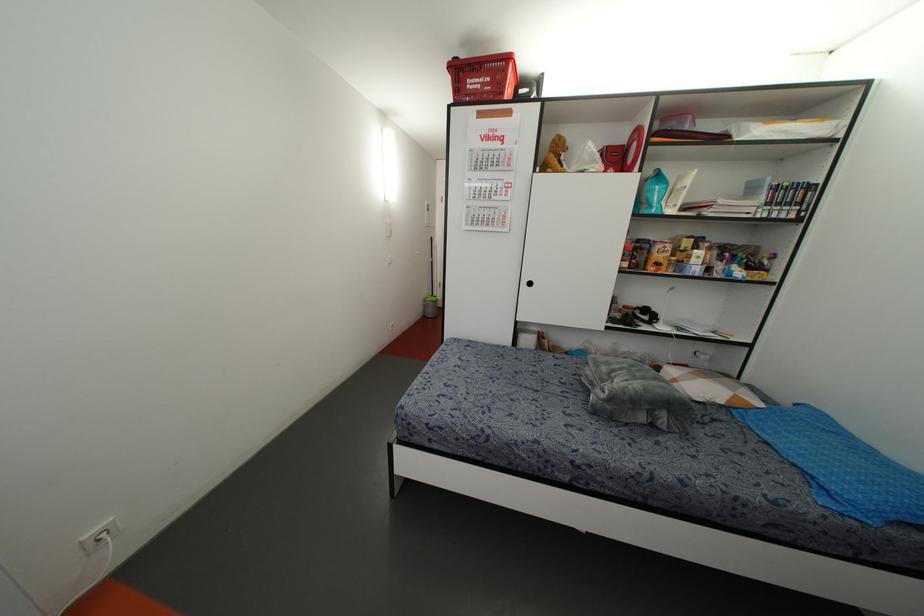
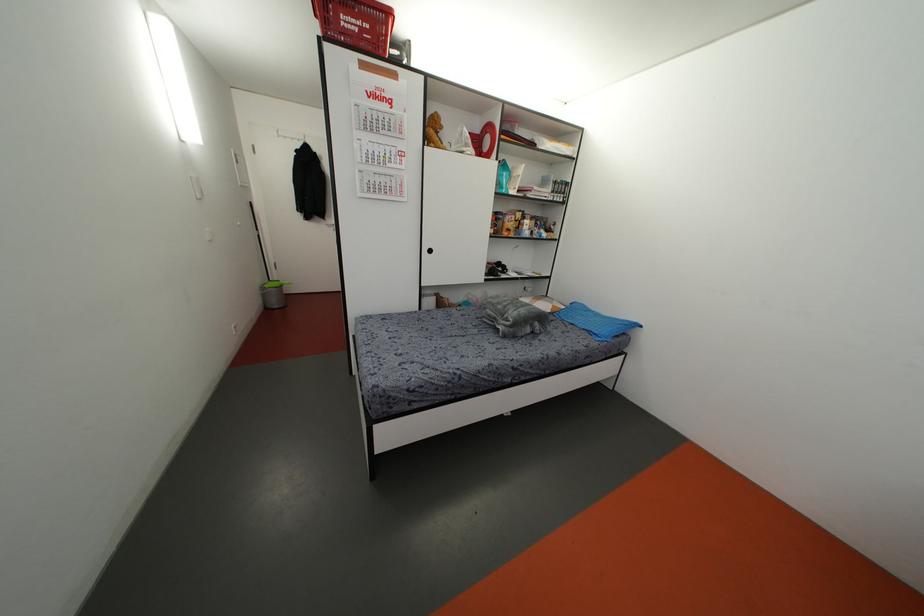
Where in the second image is the point corresponding to the point at 831,487 from the first image?

(596, 331)